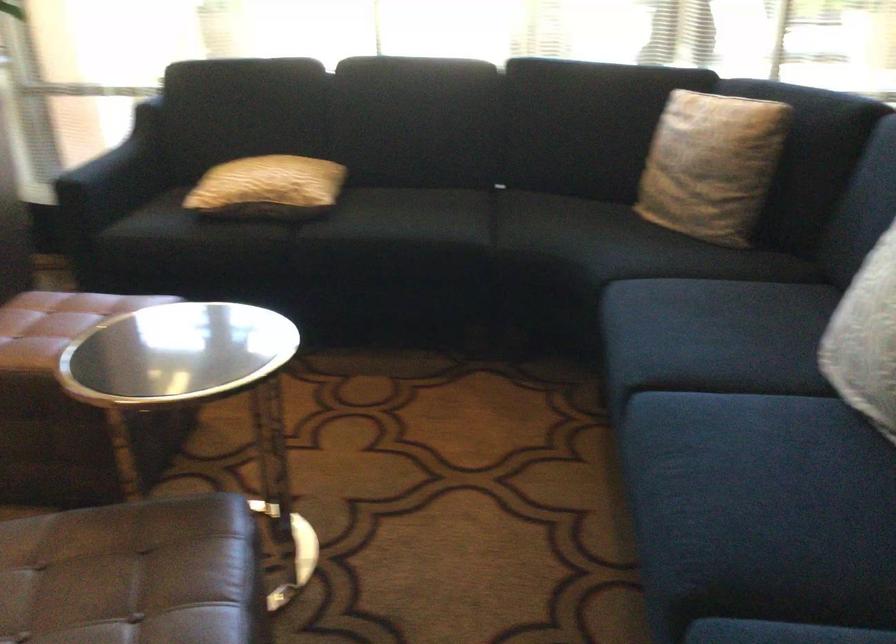
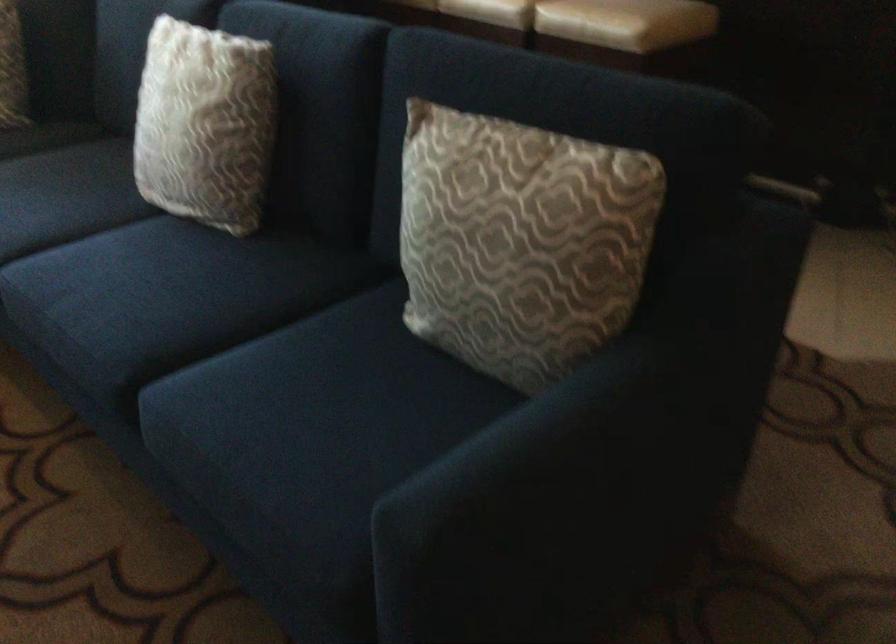
Question: Based on the continuous images, in which direction is the camera rotating? Reply with the corresponding letter.

Choices:
 (A) Left
 (B) Right
 (C) Up
 (D) Down

Answer: (B)